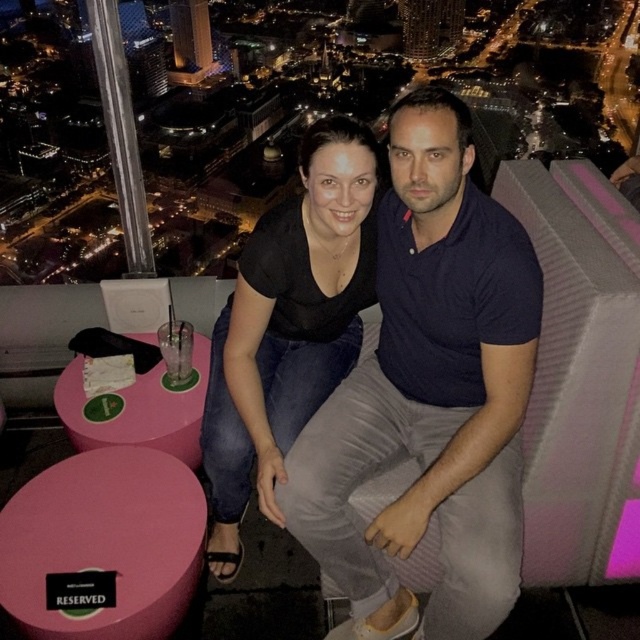
You are a photographer trying to capture a candid shot of the two people on the rooftop. You want to ensure that both the dark blue cotton shirt at center and the black matte shirt at center are clearly visible in the frame. Based on their positions, which shirt will appear higher in your photo?

The dark blue cotton shirt at center is located above the black matte shirt at center, so it will appear higher in the photo.

You are a photographer trying to capture a clear photo of both the dark blue cotton shirt at center and the black matte shirt at center. Since you want to ensure both are in focus, which one should you focus on first to account for their sizes?

You should focus on the dark blue cotton shirt at center first because it is larger in size than the black matte shirt at center, so ensuring it is in focus will help both shirts be sharp in the photo.

You are a photographer planning to take a portrait of the two individuals wearing dark blue cotton shirt at center and black matte shirt at center. Given their current positions, which one would you need to ask to move forward slightly to ensure both are in focus?

The dark blue cotton shirt at center is taller than the black matte shirt at center, so you should ask the dark blue cotton shirt at center to move forward slightly to ensure both are in focus.